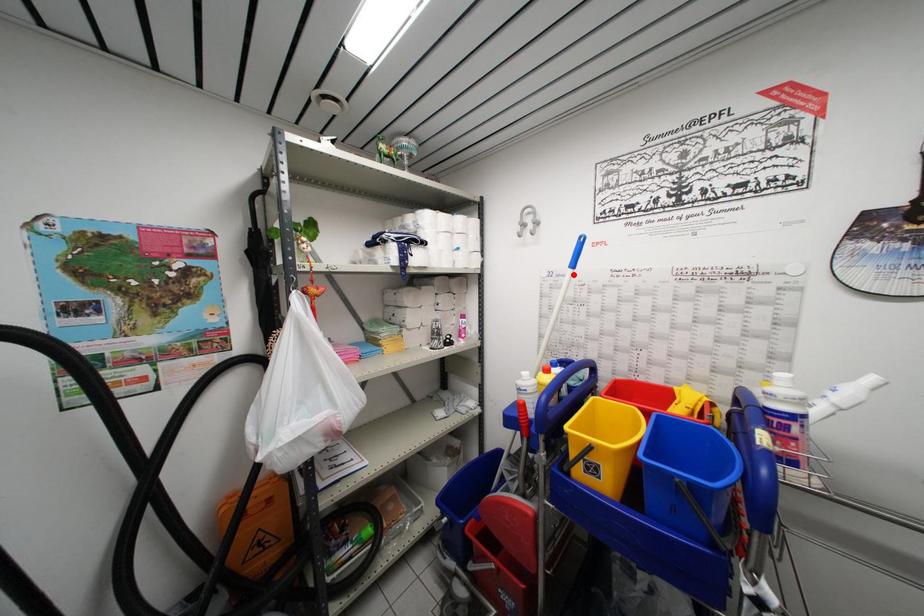
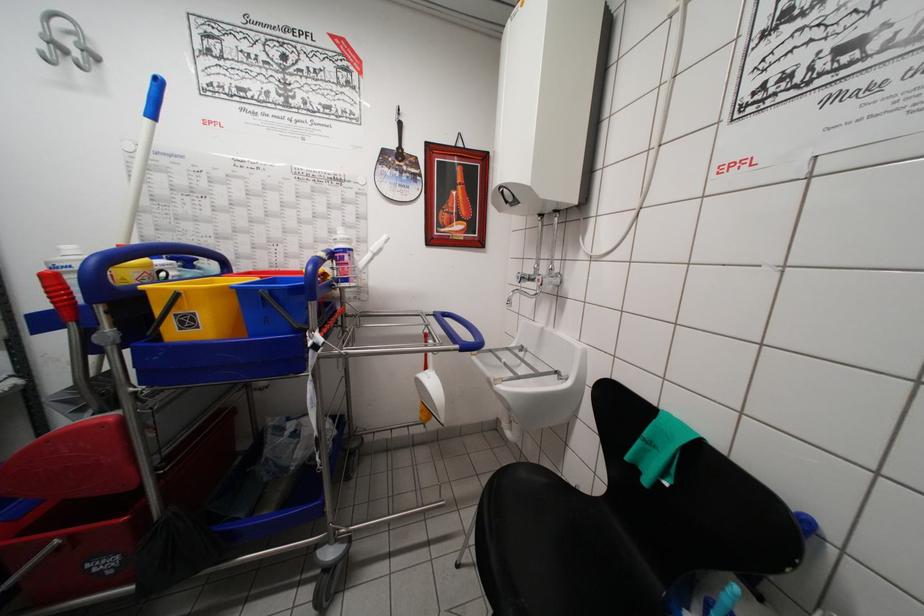
Locate, in the second image, the point that corresponds to the highlighted location in the first image.

(151, 124)